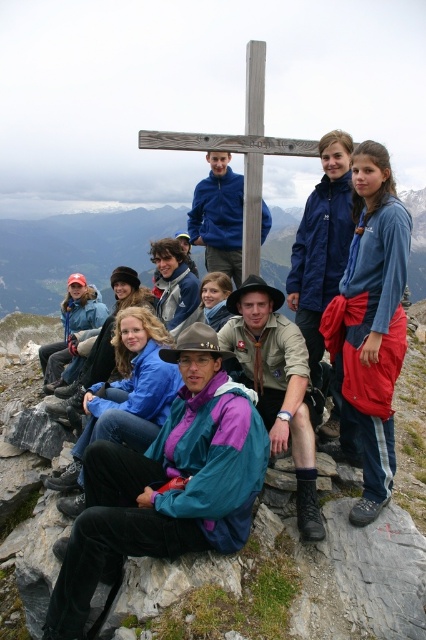
You are a photographer trying to capture a group photo of the teal nylon jacket at center and the blue fleece jacket at upper right. Which of the two jackets should you focus on first if you want to ensure both are in frame without moving the camera?

The teal nylon jacket at center occupies less space than the blue fleece jacket at upper right, so you should focus on the blue fleece jacket at upper right first to ensure it fits within the frame since it takes up more space.

You are a photographer at the mountain summit. You want to capture a photo where the wooden cross at center is clearly visible above the blue fleece jacket at upper right. Based on the scene description, can you achieve this composition?

Yes, the blue fleece jacket at upper right is positioned under the wooden cross at center, so the wooden cross at center will naturally appear above it in the photo.